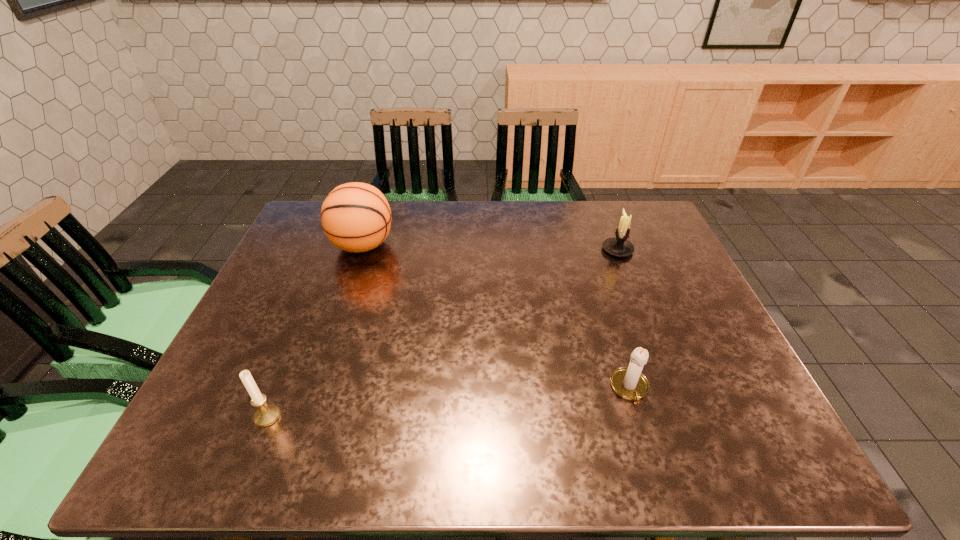
Image resolution: width=960 pixels, height=540 pixels. Identify the location of vacant area between the leftmost candle holder and the shortest object. (448, 402).

The width and height of the screenshot is (960, 540). Identify the location of vacant point located between the farthest candle holder and the shortest candle holder. [x=623, y=319].

I want to click on free space between the rightmost candle holder and the tallest object, so click(x=491, y=248).

At what (x,y) coordinates should I click in order to perform the action: click on vacant space that's between the farthest candle holder and the shortest object. Please return your answer as a coordinate pair (x, y). Looking at the image, I should click on (623, 319).

Identify the location of unoccupied area between the basketball and the leftmost candle holder. This screenshot has height=540, width=960. (315, 331).

Identify the location of object that stands as the closest to the leftmost candle holder. The width and height of the screenshot is (960, 540). 356,217.

The image size is (960, 540). Identify the location of object that can be found as the second closest to the shortest object. (356, 217).

Identify which candle holder is the second nearest to the tallest object. Please provide its 2D coordinates. Your answer should be formatted as a tuple, i.e. [(x, y)], where the tuple contains the x and y coordinates of a point satisfying the conditions above.

[(619, 246)]

Where is `candle holder that is the second closest to the farthest candle holder`? candle holder that is the second closest to the farthest candle holder is located at coordinates (267, 414).